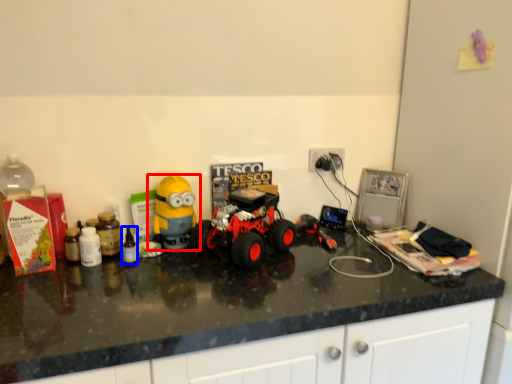
Question: Which of the following is the closest to the observer, toy (highlighted by a red box) or bottle (highlighted by a blue box)?

Choices:
 (A) toy
 (B) bottle

Answer: (B)